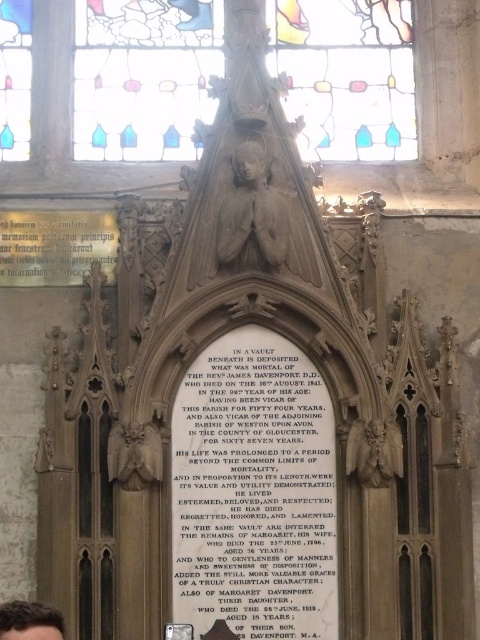
Question: Which point is farther to the camera?

Choices:
 (A) (56, 612)
 (B) (153, 93)
 (C) (181, 556)

Answer: (B)

Question: Is stained glass window at upper center above matte stone inscription at center?

Choices:
 (A) yes
 (B) no

Answer: (A)

Question: Does stained glass window at upper center appear on the left side of brown hair at lower left?

Choices:
 (A) yes
 (B) no

Answer: (B)

Question: Which object is closer to the camera taking this photo?

Choices:
 (A) matte stone inscription at center
 (B) brown hair at lower left

Answer: (B)

Question: Is matte stone inscription at center closer to camera compared to brown hair at lower left?

Choices:
 (A) yes
 (B) no

Answer: (B)

Question: Which object is the farthest from the stained glass window at upper center?

Choices:
 (A) matte stone inscription at center
 (B) brown hair at lower left

Answer: (B)